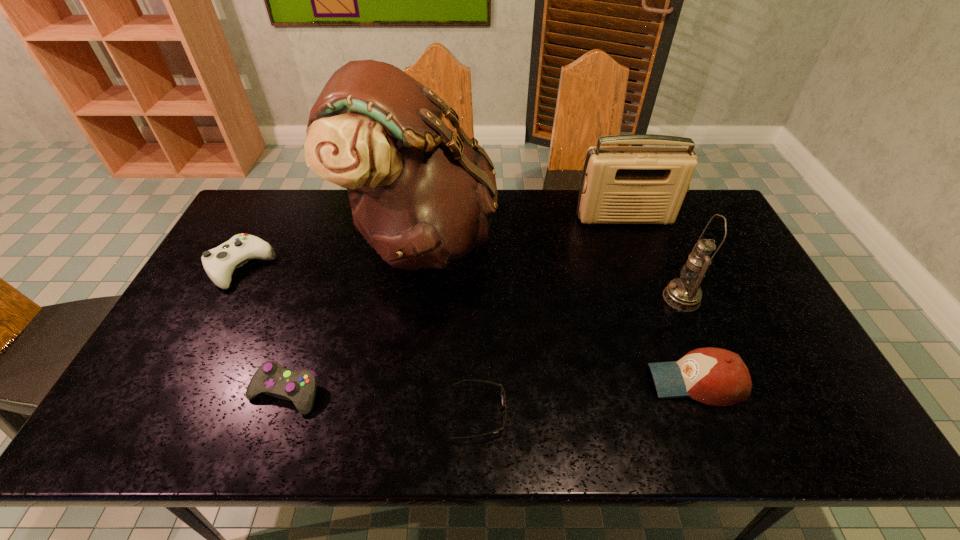
Locate an element on the screen. control that is at the near edge is located at coordinates (272, 379).

This screenshot has height=540, width=960. In order to click on sunglasses at the near edge in this screenshot , I will do `click(503, 398)`.

At what (x,y) coordinates should I click in order to perform the action: click on object that is at the left edge. Please return your answer as a coordinate pair (x, y). Looking at the image, I should click on (219, 263).

The width and height of the screenshot is (960, 540). What are the coordinates of `object present at the right edge` in the screenshot? It's located at (620, 184).

The image size is (960, 540). In order to click on object that is at the far right corner in this screenshot , I will do `click(620, 184)`.

This screenshot has width=960, height=540. In the image, there is a desktop. In order to click on vacant space at the far edge in this screenshot , I will do `click(520, 190)`.

You are a GUI agent. You are given a task and a screenshot of the screen. Output one action in this format:
    pyautogui.click(x=<x>, y=<y>)
    Task: Click on the vacant area at the near edge
    The height and width of the screenshot is (540, 960).
    Given the screenshot: What is the action you would take?
    pyautogui.click(x=299, y=436)

In the image, there is a desktop. At what (x,y) coordinates should I click in order to perform the action: click on vacant space at the left edge. Please return your answer as a coordinate pair (x, y). The image size is (960, 540). Looking at the image, I should click on (230, 239).

Locate an element on the screen. The height and width of the screenshot is (540, 960). vacant area at the right edge is located at coordinates (727, 322).

Image resolution: width=960 pixels, height=540 pixels. In the image, there is a desktop. Find the location of `vacant space at the far left corner`. vacant space at the far left corner is located at coordinates (276, 206).